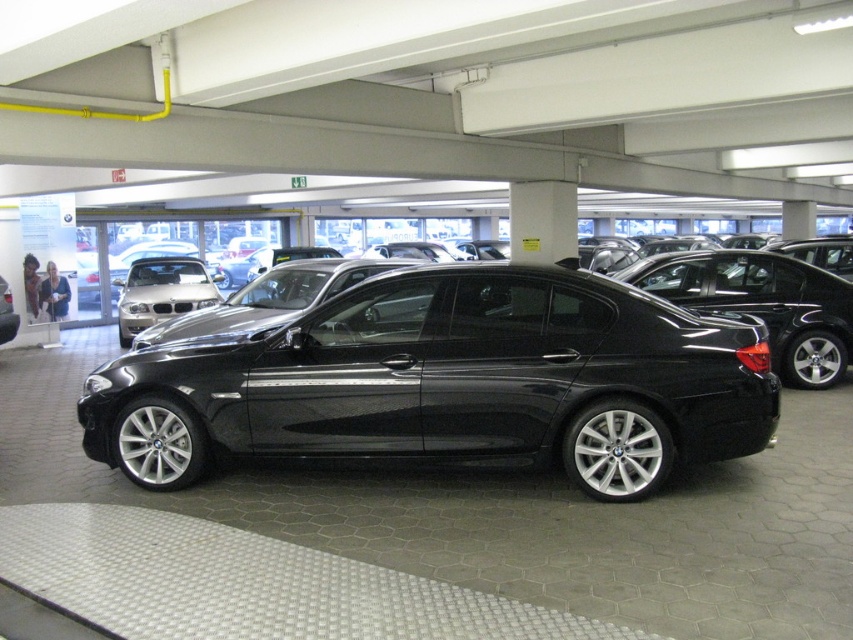
Looking at this image, you are a parking attendant who needs to direct a driver to a specific car. The driver is looking for the glossy black sedan at center. Based on the scene description, where would you tell them to look relative to the satin silver sedan at center?

The glossy black sedan at center is to the right of the satin silver sedan at center, so you should direct the driver to look to the right side of the satin silver sedan at center to find it.

You are a delivery person standing next to the glossy black sedan at center. You need to move a 4.5 meter long ladder from the sedan to the loading dock behind you. Is there enough space between the sedan and the loading dock to move the ladder without tilting it?

The distance between the glossy black sedan at center and the loading dock is 4.74 meters. Since the ladder is 4.5 meters long, there is sufficient space to move it without tilting.